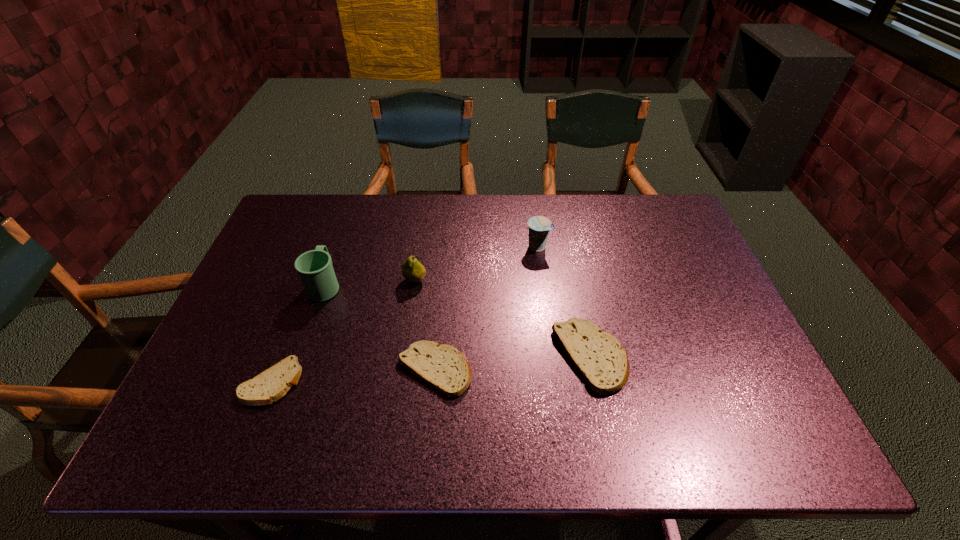
Locate an element on the screen. This screenshot has width=960, height=540. vacant space located 0.320m on the left of the second pita bread from right to left is located at coordinates (263, 370).

Image resolution: width=960 pixels, height=540 pixels. Find the location of `blank area located 0.270m on the right of the third shortest object`. blank area located 0.270m on the right of the third shortest object is located at coordinates (737, 357).

This screenshot has width=960, height=540. In order to click on vacant space located on the side of the mug with the handle in this screenshot , I will do `click(356, 196)`.

Locate an element on the screen. The width and height of the screenshot is (960, 540). free spot located on the side of the mug with the handle is located at coordinates [336, 255].

The width and height of the screenshot is (960, 540). I want to click on vacant region located on the side of the mug with the handle, so click(348, 219).

Find the location of `vacant space located on the back of the yogurt`. vacant space located on the back of the yogurt is located at coordinates (535, 227).

Identify the location of vacant region located 0.350m on the left of the pear. This screenshot has height=540, width=960. point(281,280).

Where is `object located at the left edge`? This screenshot has height=540, width=960. object located at the left edge is located at coordinates (272, 384).

Locate an element on the screen. object at the near left corner is located at coordinates (272, 384).

In order to click on vacant space at the far edge of the desktop in this screenshot , I will do `click(455, 221)`.